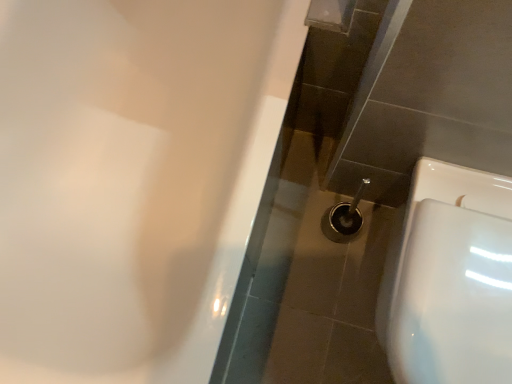
Question: Is white glossy toilet at lower right wider or thinner than white glossy bathtub at upper left?

Choices:
 (A) wide
 (B) thin

Answer: (B)

Question: From a real-world perspective, relative to white glossy bathtub at upper left, is white glossy toilet at lower right vertically above or below?

Choices:
 (A) above
 (B) below

Answer: (B)

Question: Does point coord(392,240) appear closer or farther from the camera than point coord(226,16)?

Choices:
 (A) closer
 (B) farther

Answer: (A)

Question: Looking at the image, does white glossy bathtub at upper left seem bigger or smaller compared to white glossy toilet at lower right?

Choices:
 (A) small
 (B) big

Answer: (B)

Question: Choose the correct answer: Is white glossy bathtub at upper left inside white glossy toilet at lower right or outside it?

Choices:
 (A) inside
 (B) outside

Answer: (B)

Question: From a real-world perspective, is white glossy bathtub at upper left positioned above or below white glossy toilet at lower right?

Choices:
 (A) above
 (B) below

Answer: (A)

Question: In terms of width, does white glossy bathtub at upper left look wider or thinner when compared to white glossy toilet at lower right?

Choices:
 (A) wide
 (B) thin

Answer: (A)